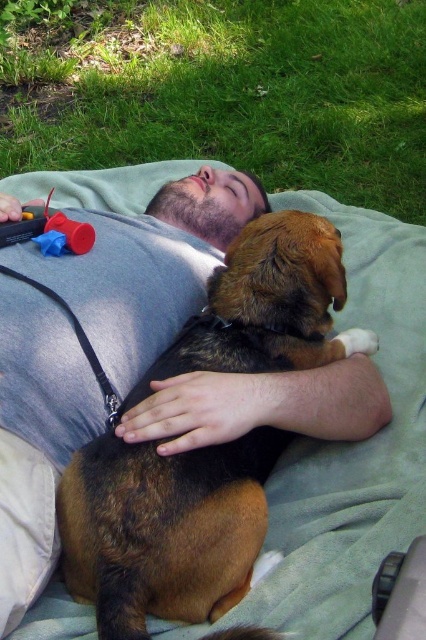
You are a photographer trying to capture the man and his dog in the scene. Since the green grass at upper center is blocking part of the brown fur dog at center, can you adjust your position to get a clear shot of the dog without the grass in the way?

The brown fur dog at center is behind the green grass at upper center, so moving your camera position slightly forward or to the side might allow you to capture the dog without the grass obstructing the view.

You are a photographer trying to capture the scene of a man and his dog resting in a park. You need to position your camera so that the green grass at upper center and the rubberized plastic toy at upper left are both visible in the frame. Based on their positions, which object should be placed higher in your photo?

The green grass at upper center should be placed higher in the photo since it is positioned above the rubberized plastic toy at upper left.